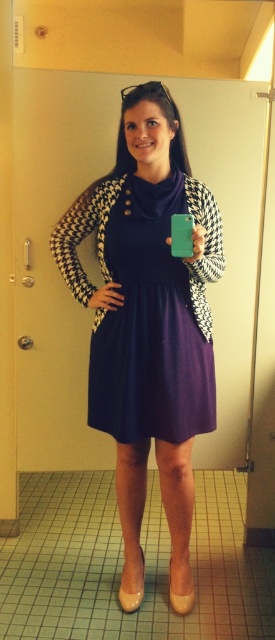
Is matte black dress at center to the right of purple matte dress at center from the viewer's perspective?

In fact, matte black dress at center is to the left of purple matte dress at center.

Between matte black dress at center and purple matte dress at center, which one has more height?

With more height is matte black dress at center.

Find the location of `matte black dress at center`. matte black dress at center is located at coordinates (147, 323).